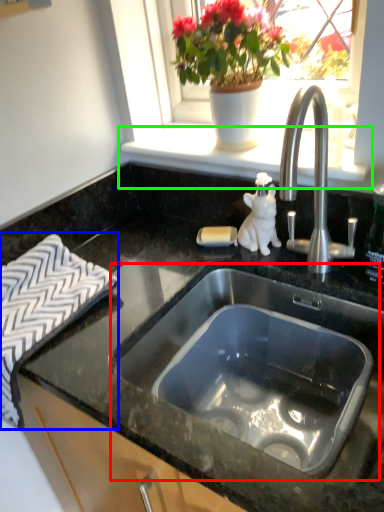
Question: Which is nearer to the sink (highlighted by a red box)? bath towel (highlighted by a blue box) or window sill (highlighted by a green box).

Choices:
 (A) bath towel
 (B) window sill

Answer: (A)